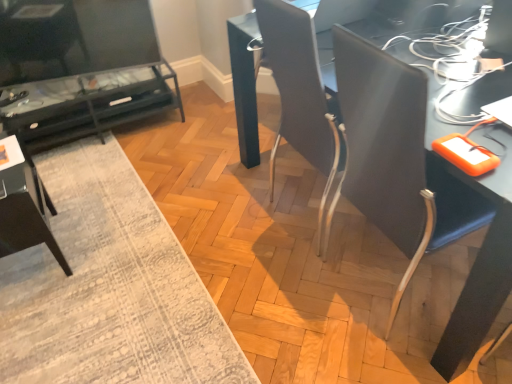
At what (x,y) coordinates should I click in order to perform the action: click on vacant space situated on the left part of matte black table at center, the 1th table from the right. Please return your answer as a coordinate pair (x, y). Looking at the image, I should click on (231, 220).